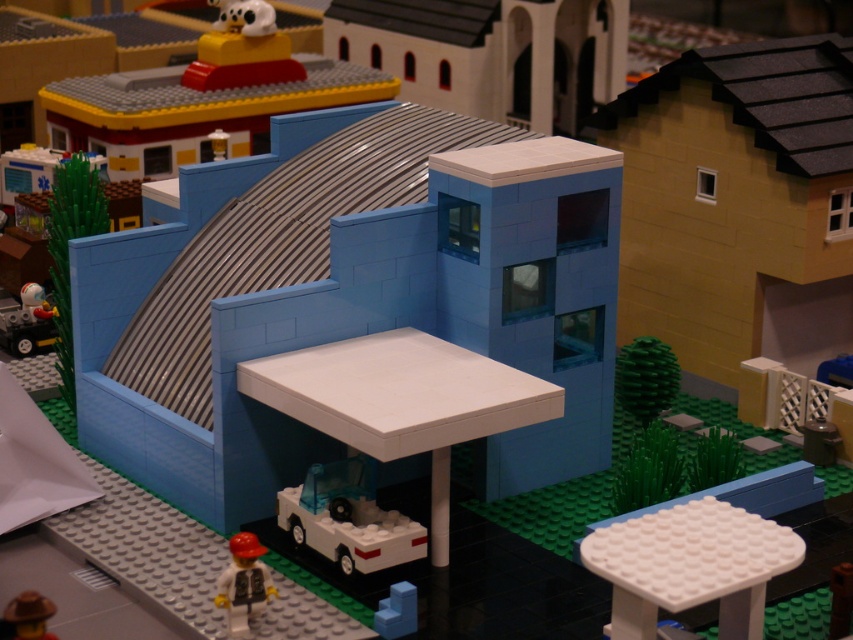
From the picture: Between white plastic minifigure at lower left and brown matte hat at lower left, which one appears on the left side from the viewer's perspective?

From the viewer's perspective, brown matte hat at lower left appears more on the left side.

The width and height of the screenshot is (853, 640). What are the coordinates of `white plastic minifigure at lower left` in the screenshot? It's located at (242, 584).

Between white plastic stool at lower right and transparent plastic car at lower center, which one is positioned lower?

white plastic stool at lower right

Where is `white plastic stool at lower right`? white plastic stool at lower right is located at coordinates (689, 564).

Who is more forward, (648, 529) or (357, 486)?

Positioned in front is point (648, 529).

This screenshot has height=640, width=853. Identify the location of white plastic stool at lower right. (689, 564).

Does white plastic stool at lower right appear on the left side of smooth blue stairs at lower center?

Incorrect, white plastic stool at lower right is not on the left side of smooth blue stairs at lower center.

Is white plastic stool at lower right smaller than smooth blue stairs at lower center?

No, white plastic stool at lower right is not smaller than smooth blue stairs at lower center.

In the scene shown: Who is more forward, (659, 566) or (396, 596)?

Point (659, 566) is more forward.

The image size is (853, 640). Identify the location of white plastic stool at lower right. (689, 564).